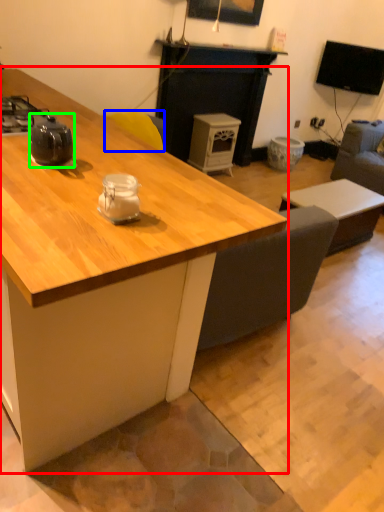
Question: Considering the real-world distances, which object is farthest from desk (highlighted by a red box)? armchair (highlighted by a blue box) or tea pot (highlighted by a green box)?

Choices:
 (A) armchair
 (B) tea pot

Answer: (A)